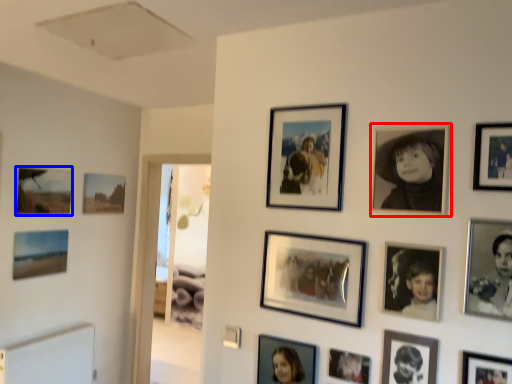
Question: Which object is further to the camera taking this photo, picture frame (highlighted by a red box) or picture frame (highlighted by a blue box)?

Choices:
 (A) picture frame
 (B) picture frame

Answer: (B)